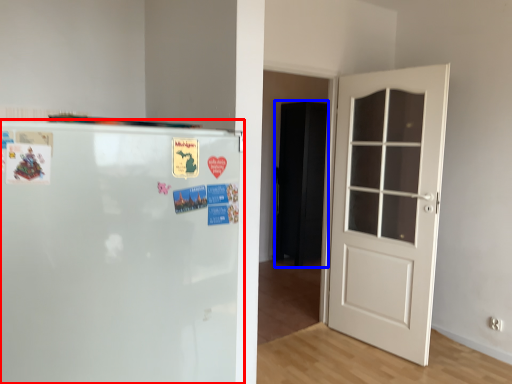
Question: Which object appears farthest to the camera in this image, refrigerator (highlighted by a red box) or armoire (highlighted by a blue box)?

Choices:
 (A) refrigerator
 (B) armoire

Answer: (B)